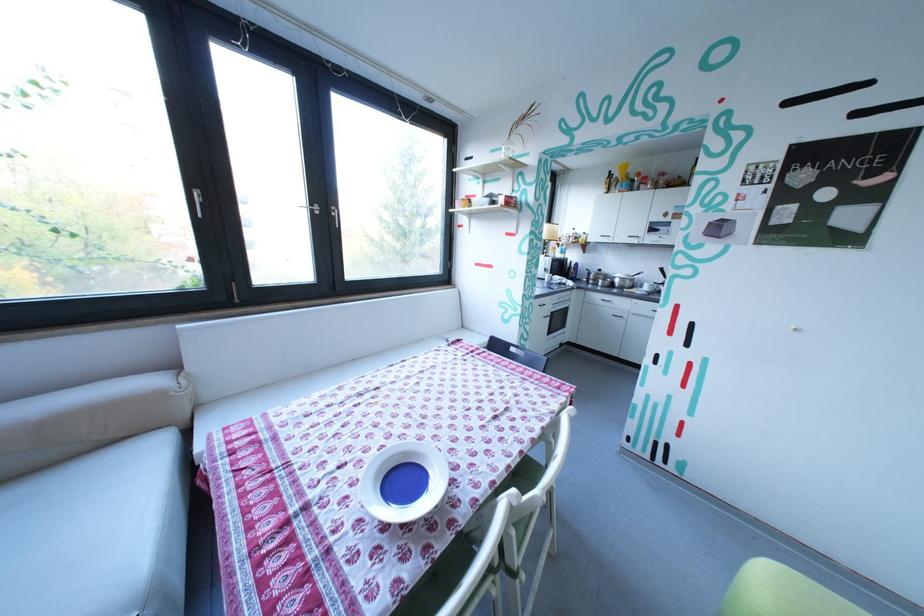
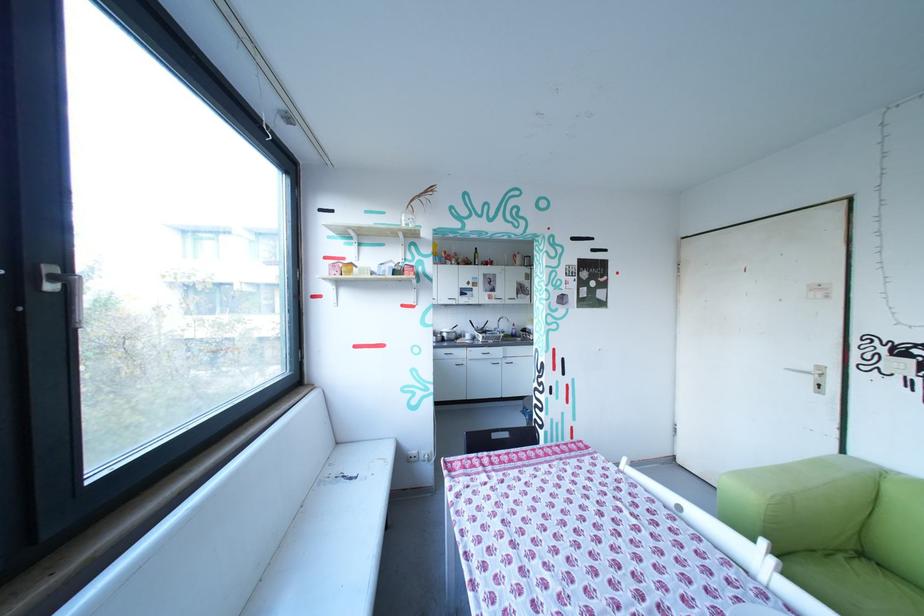
Question: I am providing you with two images of the same scene from different viewpoints. Which of the following objects are not visible in image2?

Choices:
 (A) bottle with yellow cap
 (B) oven door handle
 (C) pink soap dispenser
 (D) clear glass vase

Answer: (B)